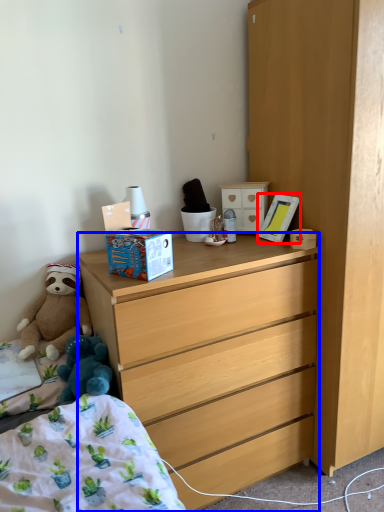
Question: Among these objects, which one is nearest to the camera, picture frame (highlighted by a red box) or desk (highlighted by a blue box)?

Choices:
 (A) picture frame
 (B) desk

Answer: (B)